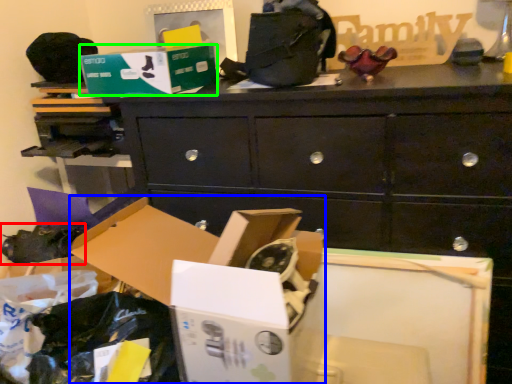
Question: Estimate the real-world distances between objects in this image. Which object is farther from shoe (highlighted by a red box), storage box (highlighted by a blue box) or storage box (highlighted by a green box)?

Choices:
 (A) storage box
 (B) storage box

Answer: (A)